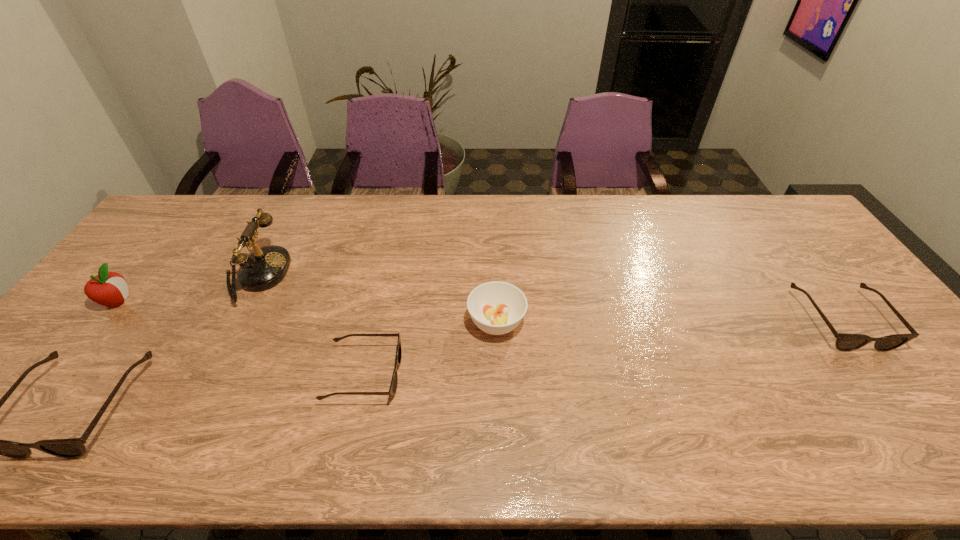
To make them evenly spaced by inserting another sunglasses among them, please locate a free space for this new sunglasses. Please provide its 2D coordinates. Your answer should be formatted as a tuple, i.e. [(x, y)], where the tuple contains the x and y coordinates of a point satisfying the conditions above.

[(614, 346)]